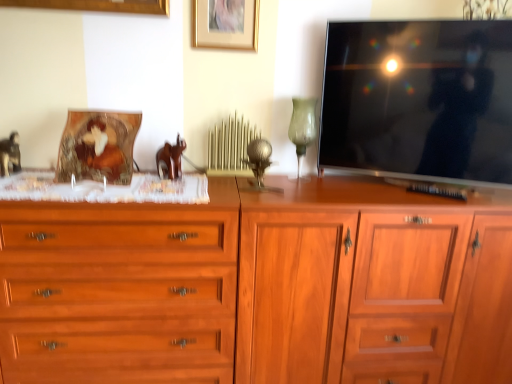
Question: Does green glass vase at upper center, the 2th table lamp from the left, lie behind matte black tv at upper right?

Choices:
 (A) yes
 (B) no

Answer: (A)

Question: Considering the relative sizes of green glass vase at upper center, the 2th table lamp from the left, and matte black tv at upper right in the image provided, is green glass vase at upper center, the 2th table lamp from the left, wider than matte black tv at upper right?

Choices:
 (A) yes
 (B) no

Answer: (A)

Question: Considering the relative sizes of green glass vase at upper center, placed as the 1th table lamp when sorted from right to left, and matte black tv at upper right in the image provided, is green glass vase at upper center, placed as the 1th table lamp when sorted from right to left, taller than matte black tv at upper right?

Choices:
 (A) no
 (B) yes

Answer: (A)

Question: Is green glass vase at upper center, the 2th table lamp from the left, beside matte black tv at upper right?

Choices:
 (A) yes
 (B) no

Answer: (B)

Question: From a real-world perspective, is green glass vase at upper center, placed as the 1th table lamp when sorted from right to left, below matte black tv at upper right?

Choices:
 (A) no
 (B) yes

Answer: (B)

Question: Would you say wooden cabinet at center, the 2th chest of drawers from the left, is to the left or to the right of green glass vase at upper center, the 2th table lamp from the left, in the picture?

Choices:
 (A) right
 (B) left

Answer: (A)

Question: Choose the correct answer: Is wooden cabinet at center, the 2th chest of drawers from the left, inside green glass vase at upper center, the 2th table lamp from the left, or outside it?

Choices:
 (A) outside
 (B) inside

Answer: (A)

Question: Looking at their shapes, would you say wooden cabinet at center, the 2th chest of drawers from the left, is wider or thinner than green glass vase at upper center, placed as the 1th table lamp when sorted from right to left?

Choices:
 (A) wide
 (B) thin

Answer: (A)

Question: Is wooden cabinet at center, which is the first chest of drawers in right-to-left order, in front of or behind green glass vase at upper center, placed as the 1th table lamp when sorted from right to left, in the image?

Choices:
 (A) front
 (B) behind

Answer: (A)

Question: Is matte black tv at upper right in front of or behind brown wooden horse at center in the image?

Choices:
 (A) behind
 (B) front

Answer: (B)

Question: In the image, is matte black tv at upper right on the left side or the right side of brown wooden horse at center?

Choices:
 (A) left
 (B) right

Answer: (B)

Question: From a real-world perspective, is matte black tv at upper right positioned above or below brown wooden horse at center?

Choices:
 (A) below
 (B) above

Answer: (B)

Question: Based on their sizes in the image, would you say matte black tv at upper right is bigger or smaller than brown wooden horse at center?

Choices:
 (A) big
 (B) small

Answer: (A)

Question: Considering the positions of brown wooden horse at center and green glass vase at upper center, the 2th table lamp from the left, in the image, is brown wooden horse at center bigger or smaller than green glass vase at upper center, the 2th table lamp from the left,?

Choices:
 (A) big
 (B) small

Answer: (B)

Question: From a real-world perspective, is brown wooden horse at center positioned above or below green glass vase at upper center, the 2th table lamp from the left?

Choices:
 (A) below
 (B) above

Answer: (A)